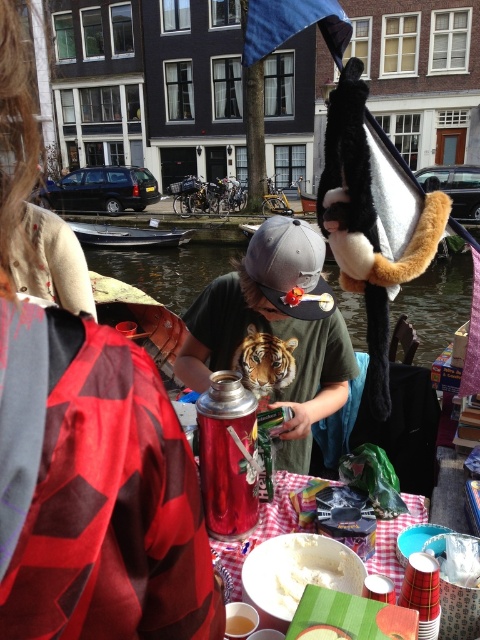
Question: Which of the following is the closest to the observer?

Choices:
 (A) (250, 330)
 (B) (424, 349)
 (C) (304, 566)
 (D) (273, 240)

Answer: (C)

Question: Which object is the closest to the flannel shirt at upper left?

Choices:
 (A) clear water at center
 (B) blue wooden boat at lower left
 (C) smooth yellowish paste at center
 (D) orange fur tiger at center

Answer: (C)

Question: Is flannel shirt at upper left closer to camera compared to orange fur tiger at center?

Choices:
 (A) yes
 (B) no

Answer: (A)

Question: Can you confirm if clear water at center is bigger than white matte bowl at center?

Choices:
 (A) yes
 (B) no

Answer: (A)

Question: Observing the image, what is the correct spatial positioning of orange fur tiger at center in reference to smooth yellowish paste at center?

Choices:
 (A) right
 (B) left

Answer: (A)

Question: Among these objects, which one is farthest from the camera?

Choices:
 (A) orange fur tiger at center
 (B) checkered fabric tablecloth at lower center

Answer: (A)